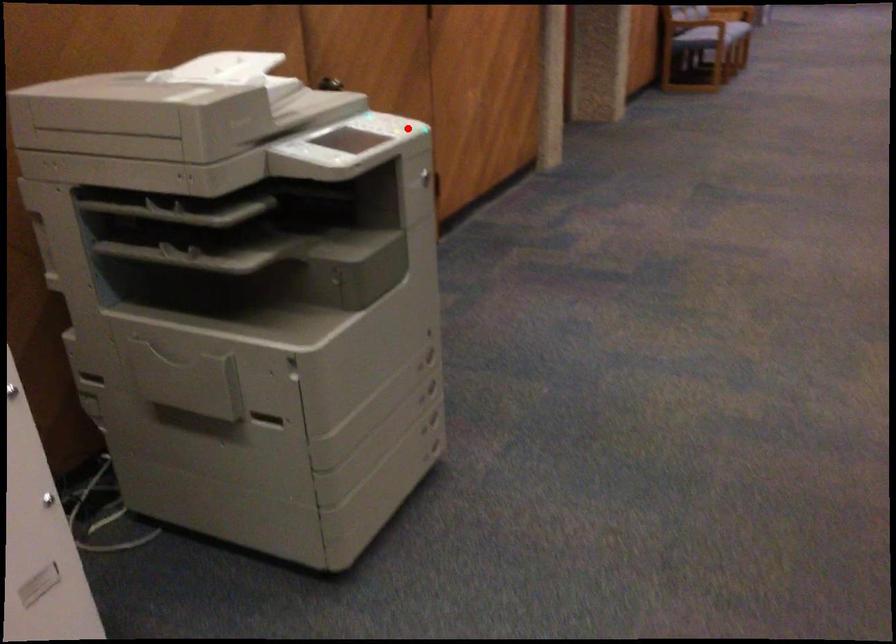
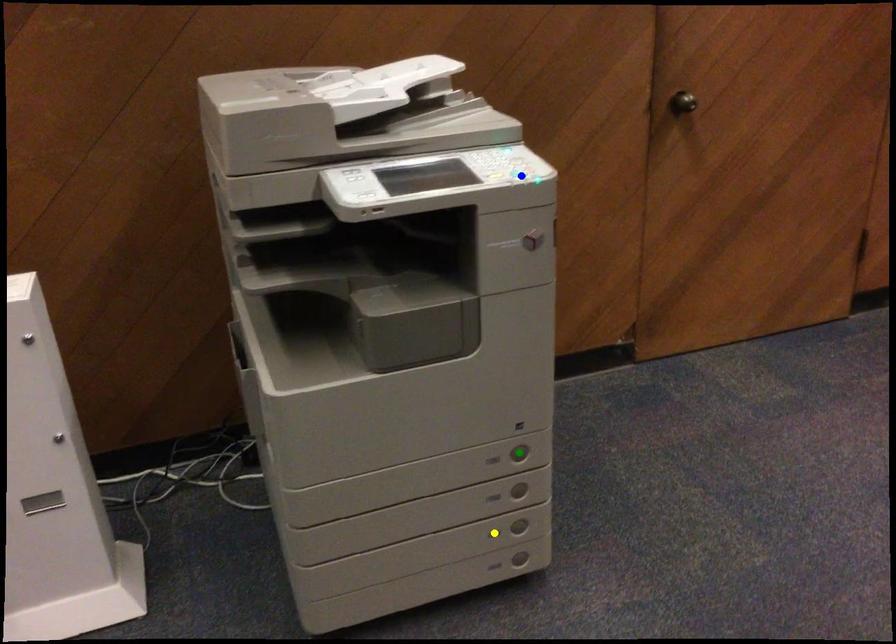
Question: I am providing you with two images of the same scene from different viewpoints. A red point is marked on the first image. You are given multiple points on the second image. Which spot in image 2 lines up with the point in image 1?

Choices:
 (A) green point
 (B) yellow point
 (C) blue point

Answer: (C)